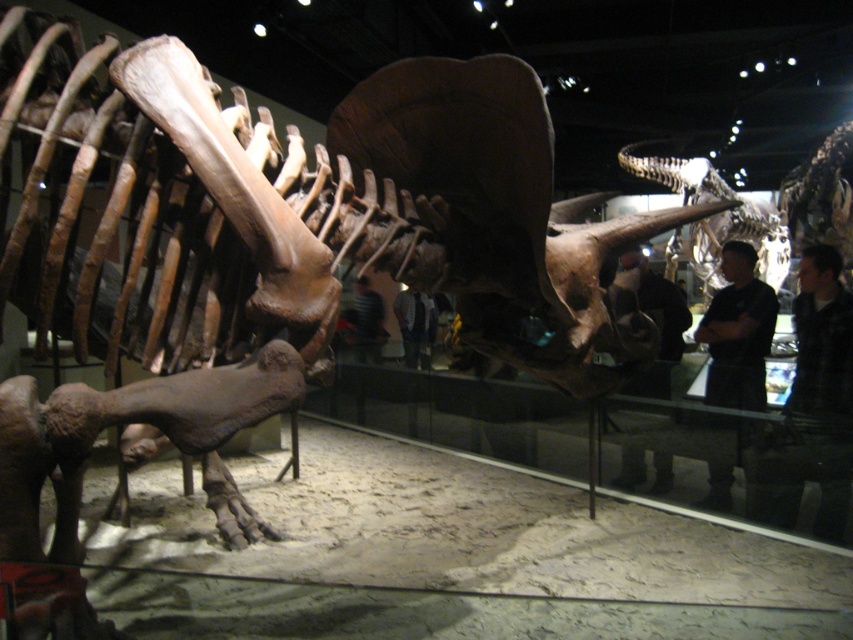
Where is `brown matte skull at center`? brown matte skull at center is located at coordinates (717, 218).

Does point (752, 211) come in front of point (616, 280)?

No, (752, 211) is further to viewer.

I want to click on brown matte skull at center, so click(717, 218).

What do you see at coordinates (415, 326) in the screenshot? This screenshot has height=640, width=853. I see `dark blue jeans at center` at bounding box center [415, 326].

Looking at this image, measure the distance from dark blue jeans at center to striped shirt at center.

The distance of dark blue jeans at center from striped shirt at center is 26.55 inches.

At what (x,y) coordinates should I click in order to perform the action: click on dark blue jeans at center. Please return your answer as a coordinate pair (x, y). This screenshot has width=853, height=640. Looking at the image, I should click on (415, 326).

Is point (618, 275) less distant than point (381, 305)?

Yes, it is in front of point (381, 305).

Between dark clothing at center and striped shirt at center, which one has more height?

With more height is striped shirt at center.

Describe the element at coordinates (653, 317) in the screenshot. I see `dark clothing at center` at that location.

Identify the location of dark clothing at center. (653, 317).